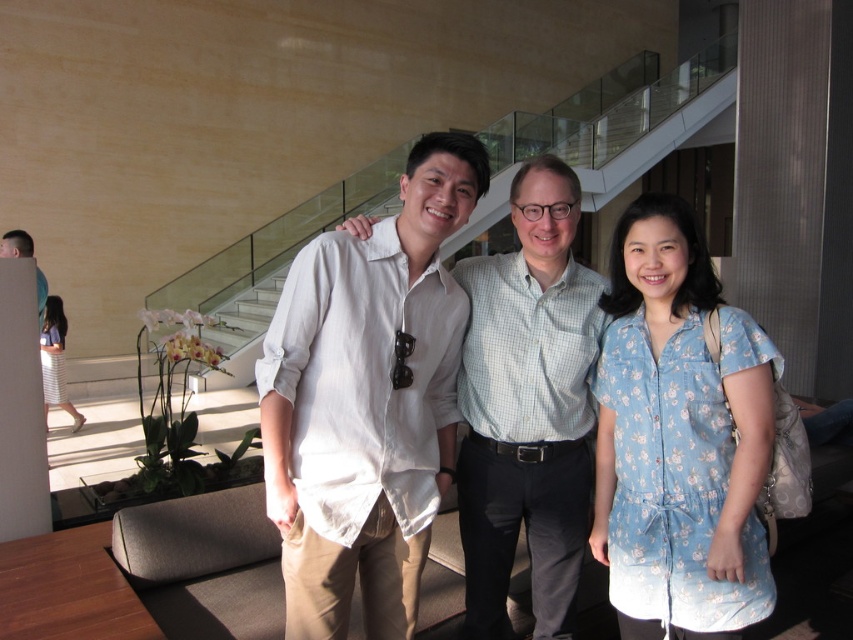
You are a photographer standing 1.5 meters away from the white linen shirt at center and the light blue checkered shirt at center. Can you fit both subjects into a single frame if your camera has a maximum field of view of 1.8 meters?

The distance between the white linen shirt at center and the light blue checkered shirt at center is 32.34 centimeters. Since the camera has a maximum field of view of 1.8 meters, which is significantly larger than the distance between them, both subjects can easily fit into a single frame.

You are a photographer setting up a shoot in this space. You need to ensure that the light blue checkered shirt at center and the matte black shirt at left are both visible in the frame. Given their height difference, which shirt should you position closer to the camera to maintain visibility?

The light blue checkered shirt at center is much taller than the matte black shirt at left, so positioning the matte black shirt at left closer to the camera will help ensure both are visible in the frame.

You are a photographer setting up a backdrop for a photoshoot. The backdrop is 1.2 meters wide. You need to position the white cotton shirt at center and the matte black shirt at left so that both shirts fit within the backdrop without overlapping. Can you arrange them this way?

The white cotton shirt at center might be wider than matte black shirt at left, so you should place them side by side on the backdrop. However, since the total width of both shirts combined could exceed the backdrop width of 1.2 meters, it depends on their individual widths. If the white cotton shirt at center is wider but not exceeding 1.2 meters when placed alone, it might fit, but adding the matte black shirt at left might make them too wide. Without exact measurements, it is uncertain if both can fit.